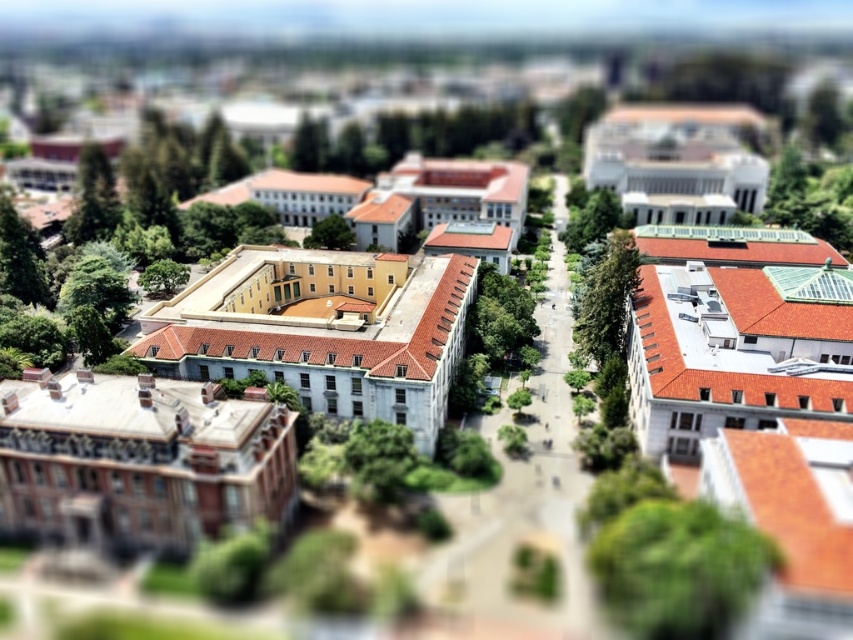
Question: Does green leafy tree at lower right have a lesser width compared to green leafy tree at center-right?

Choices:
 (A) no
 (B) yes

Answer: (B)

Question: Which of these objects is positioned farthest from the green leafy tree at center-right?

Choices:
 (A) green leafy tree at center
 (B) green leafy tree at lower right

Answer: (A)

Question: Which of the following is the farthest from the observer?

Choices:
 (A) green leafy tree at center-right
 (B) green leafy tree at lower right

Answer: (A)

Question: Does green leafy tree at lower right have a smaller size compared to green leafy tree at center?

Choices:
 (A) yes
 (B) no

Answer: (A)

Question: Which object is positioned farthest from the green leafy tree at lower right?

Choices:
 (A) green leafy tree at center
 (B) green leafy tree at center-right

Answer: (A)

Question: Can you confirm if green leafy tree at center-right is thinner than green leafy tree at center?

Choices:
 (A) no
 (B) yes

Answer: (A)